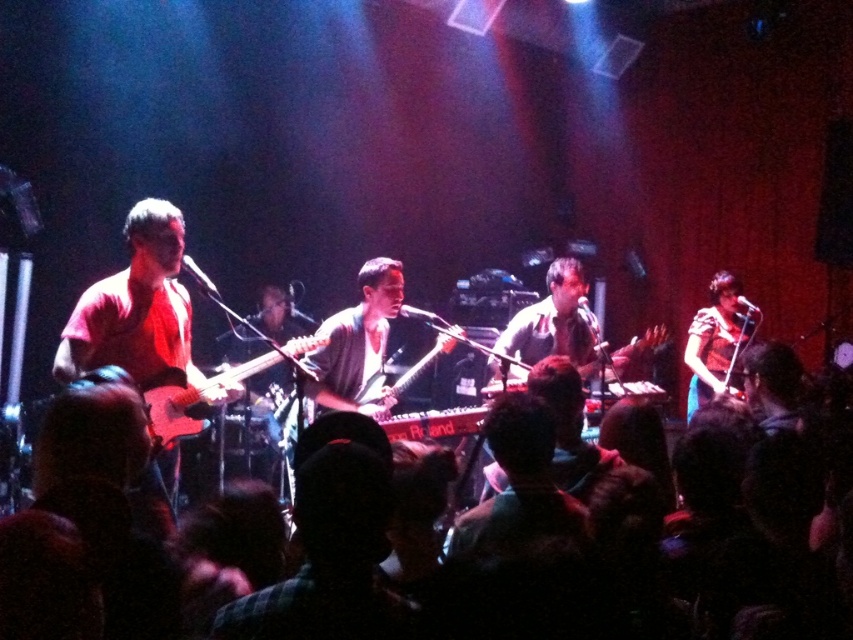
Is black fabric crowd at lower center above matte blue dress at right?

Incorrect, black fabric crowd at lower center is not positioned above matte blue dress at right.

Is black fabric crowd at lower center smaller than matte blue dress at right?

Incorrect, black fabric crowd at lower center is not smaller in size than matte blue dress at right.

Image resolution: width=853 pixels, height=640 pixels. I want to click on black fabric crowd at lower center, so click(x=764, y=540).

I want to click on black fabric crowd at lower center, so click(x=764, y=540).

Who is higher up, matte blue dress at right or matte white electric guitar at left?

matte blue dress at right

Who is more distant from viewer, (691, 410) or (152, 422)?

Point (691, 410)

Is point (695, 323) closer to viewer compared to point (277, 360)?

That is False.

Where is `matte blue dress at right`? Image resolution: width=853 pixels, height=640 pixels. matte blue dress at right is located at coordinates (717, 340).

Can you confirm if matte white electric guitar at left is shorter than shiny silver electric guitar at center?

Yes, matte white electric guitar at left is shorter than shiny silver electric guitar at center.

Can you confirm if matte white electric guitar at left is bigger than shiny silver electric guitar at center?

Yes.

Is point (302, 339) positioned before point (380, 390)?

Yes, it is in front of point (380, 390).

Locate an element on the screen. matte white electric guitar at left is located at coordinates (204, 390).